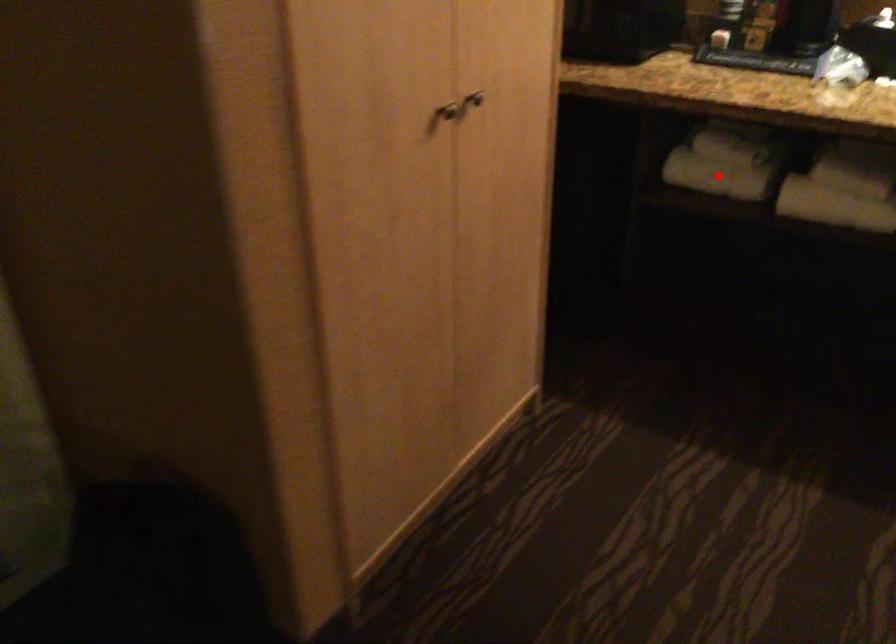
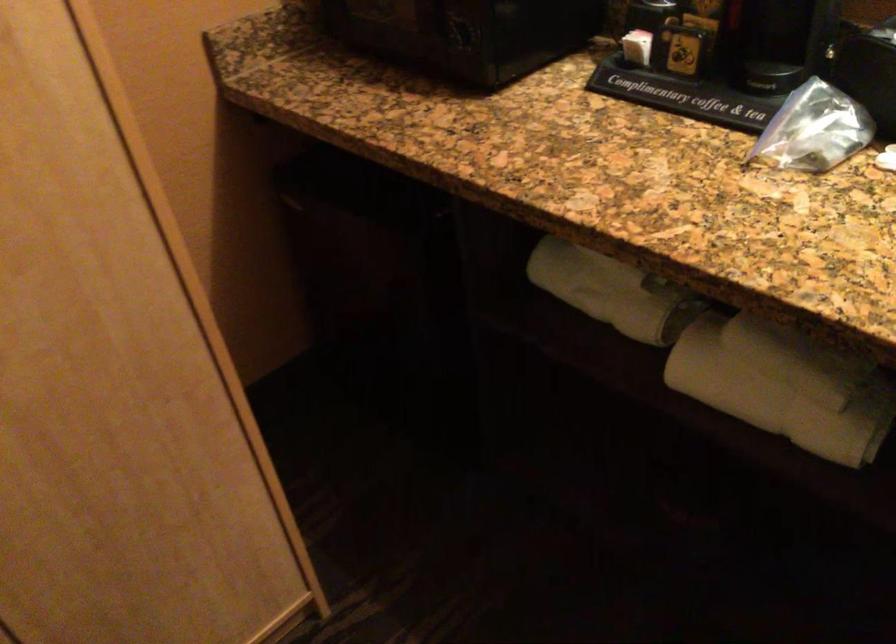
Question: I am providing you with two images of the same scene from different viewpoints. Image1 has a red point marked. In image2, the corresponding 3D location appears at what relative position? Reply with the corresponding letter.

Choices:
 (A) Closer
 (B) Farther

Answer: (A)